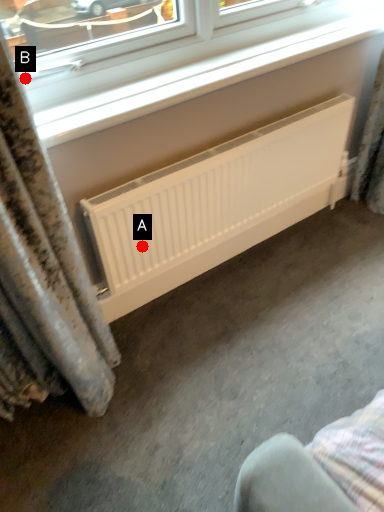
Question: Two points are circled on the image, labeled by A and B beside each circle. Which point is closer to the camera taking this photo?

Choices:
 (A) A is closer
 (B) B is closer

Answer: (B)